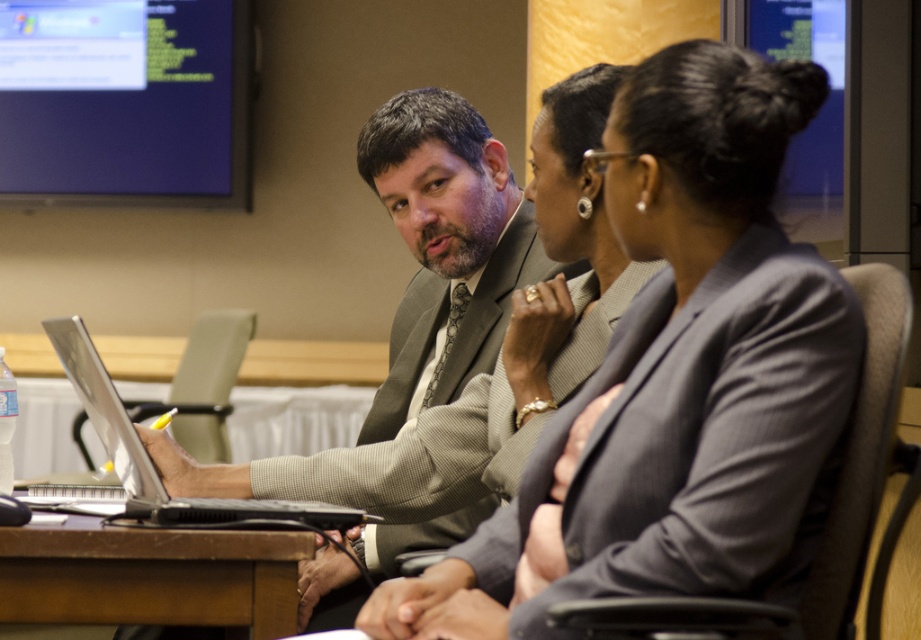
You are standing in the conference room and want to place a small plant between the two points labeled point (523, 480) and point (157, 444). Which point should the plant be closer to if you want it to be more visible to someone sitting at the table?

The plant should be placed closer to point (523, 480) because it is closer to the camera, making it more visible to those seated at the table.

You are a visitor entering the conference room and need to sit down. There is a gray suit at center and a brown wooden table at lower left. Which object can you sit on?

The brown wooden table at lower left is an object you can sit on, but the gray suit at center is a person and cannot be sat on. However, since the gray suit at center is part of the scene depicting a seated individual, the table is the appropriate place to sit.

You are standing in the conference room and need to locate the gray textured blazer at center. According to the coordinates provided, where exactly would you find it?

The gray textured blazer at center is located at point 0.688 on the x axis and 0.758 on the y axis.